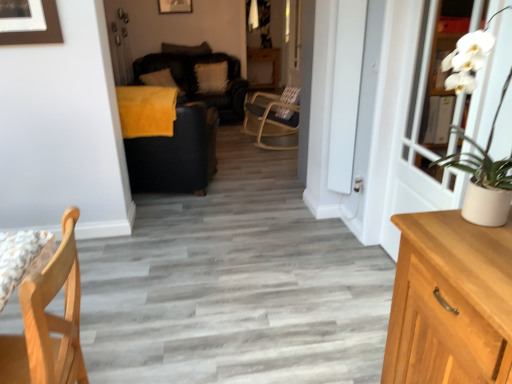
Question: Does wooden picture frame at upper center appear on the right side of dark gray fabric pillow at upper center, the second pillow in the left-to-right sequence?

Choices:
 (A) yes
 (B) no

Answer: (B)

Question: Does wooden picture frame at upper center lie behind dark gray fabric pillow at upper center, the second pillow in the left-to-right sequence?

Choices:
 (A) no
 (B) yes

Answer: (A)

Question: Could you tell me if wooden picture frame at upper center is facing dark gray fabric pillow at upper center, the second pillow in the left-to-right sequence?

Choices:
 (A) no
 (B) yes

Answer: (A)

Question: Considering the relative sizes of wooden picture frame at upper center and dark gray fabric pillow at upper center, which appears as the second pillow when viewed from the right, in the image provided, is wooden picture frame at upper center shorter than dark gray fabric pillow at upper center, which appears as the second pillow when viewed from the right,?

Choices:
 (A) no
 (B) yes

Answer: (A)

Question: From the image's perspective, is wooden picture frame at upper center beneath dark gray fabric pillow at upper center, which appears as the second pillow when viewed from the right?

Choices:
 (A) yes
 (B) no

Answer: (B)

Question: Considering the positions of soft yellow pillow at upper center, placed as the 1th pillow when sorted from left to right, and white fluffy pillow at center, which is the first pillow in right-to-left order, in the image, is soft yellow pillow at upper center, placed as the 1th pillow when sorted from left to right, wider or thinner than white fluffy pillow at center, which is the first pillow in right-to-left order,?

Choices:
 (A) thin
 (B) wide

Answer: (B)

Question: Is point (156, 84) positioned closer to the camera than point (209, 84)?

Choices:
 (A) farther
 (B) closer

Answer: (A)

Question: Do you think soft yellow pillow at upper center, the 3th pillow viewed from the right, is within white fluffy pillow at center, which is the first pillow in right-to-left order, or outside of it?

Choices:
 (A) outside
 (B) inside

Answer: (A)

Question: From the image's perspective, relative to white fluffy pillow at center, which is the first pillow in right-to-left order, is soft yellow pillow at upper center, the 3th pillow viewed from the right, above or below?

Choices:
 (A) above
 (B) below

Answer: (B)

Question: Which is correct: white fluffy pillow at center, placed as the 3th pillow when sorted from left to right, is inside wooden picture frame at upper center, or outside of it?

Choices:
 (A) inside
 (B) outside

Answer: (B)

Question: From the image's perspective, is white fluffy pillow at center, placed as the 3th pillow when sorted from left to right, positioned above or below wooden picture frame at upper center?

Choices:
 (A) below
 (B) above

Answer: (A)

Question: From a real-world perspective, relative to wooden picture frame at upper center, is white fluffy pillow at center, which is the first pillow in right-to-left order, vertically above or below?

Choices:
 (A) above
 (B) below

Answer: (B)

Question: In terms of size, does white fluffy pillow at center, which is the first pillow in right-to-left order, appear bigger or smaller than wooden picture frame at upper center?

Choices:
 (A) small
 (B) big

Answer: (B)

Question: From the image's perspective, is velvet black couch at center above or below dark gray fabric pillow at upper center, the second pillow in the left-to-right sequence?

Choices:
 (A) below
 (B) above

Answer: (A)

Question: In terms of height, does velvet black couch at center look taller or shorter compared to dark gray fabric pillow at upper center, the second pillow in the left-to-right sequence?

Choices:
 (A) tall
 (B) short

Answer: (A)